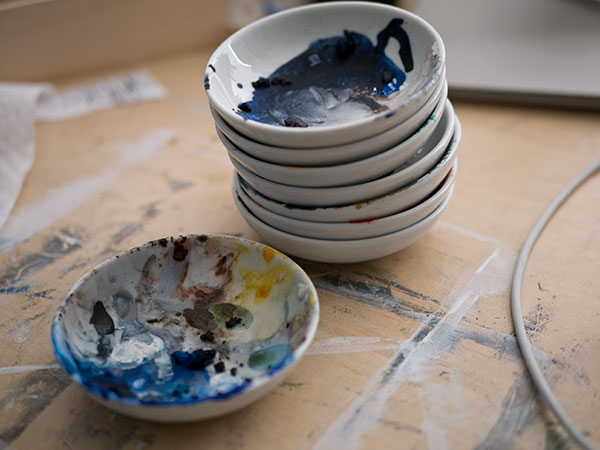
Identify the location of top dish in stack of dishes. (350, 131).